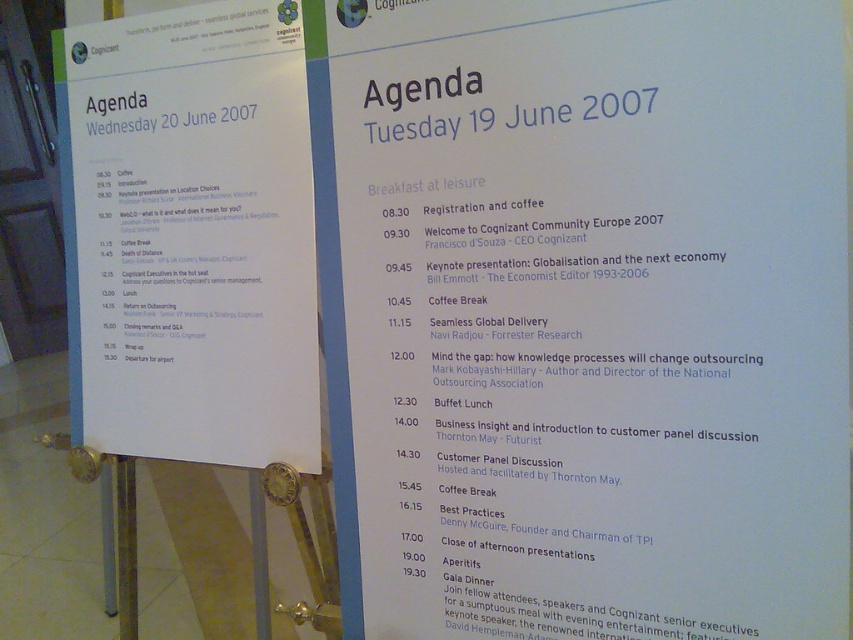
Question: Which object is farther from the camera taking this photo?

Choices:
 (A) white paper agenda at upper center
 (B) white paper agenda at upper left

Answer: (B)

Question: Can you confirm if white paper agenda at upper center is smaller than white paper agenda at upper left?

Choices:
 (A) no
 (B) yes

Answer: (B)

Question: Can you confirm if white paper agenda at upper center is wider than white paper agenda at upper left?

Choices:
 (A) no
 (B) yes

Answer: (B)

Question: Which of the following is the closest to the observer?

Choices:
 (A) white paper agenda at upper left
 (B) white paper agenda at upper center

Answer: (B)

Question: Is white paper agenda at upper center further to the viewer compared to white paper agenda at upper left?

Choices:
 (A) yes
 (B) no

Answer: (B)